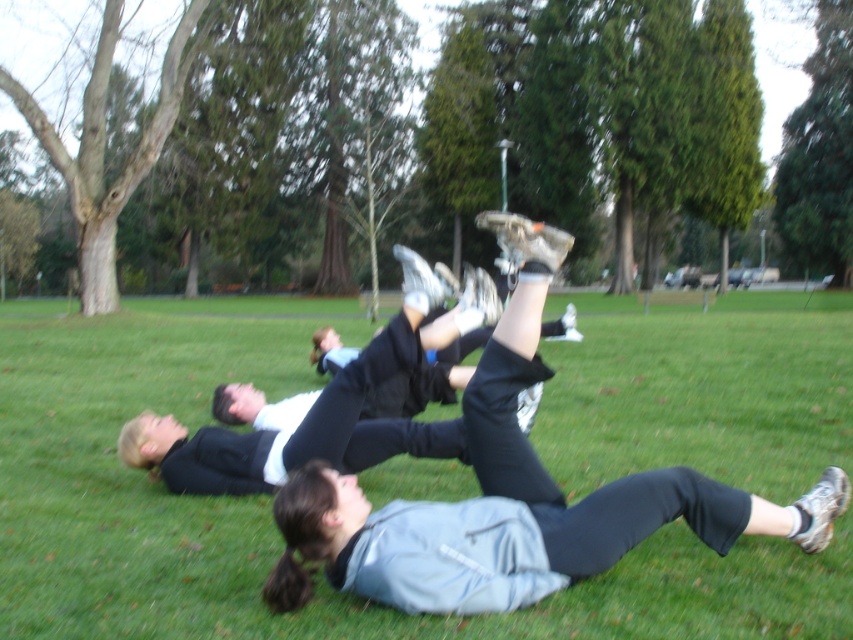
Question: Among these objects, which one is nearest to the camera?

Choices:
 (A) black matte pants at center
 (B) green grass at center

Answer: (B)

Question: Is green grass at center below black matte pants at center?

Choices:
 (A) yes
 (B) no

Answer: (B)

Question: Which point is closer to the camera?

Choices:
 (A) (447, 456)
 (B) (633, 616)

Answer: (B)

Question: Can you confirm if green grass at center is bigger than black matte pants at center?

Choices:
 (A) no
 (B) yes

Answer: (B)

Question: Does green grass at center appear on the right side of black matte pants at center?

Choices:
 (A) no
 (B) yes

Answer: (B)